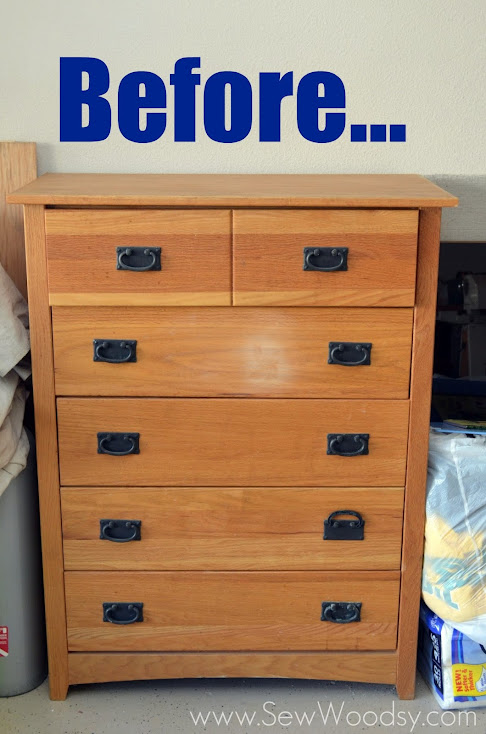
You are a GUI agent. You are given a task and a screenshot of the screen. Output one action in this format:
    pyautogui.click(x=<x>, y=<y>)
    Task: Click on the floor
    This screenshot has height=734, width=486.
    Given the screenshot: What is the action you would take?
    pyautogui.click(x=117, y=702)